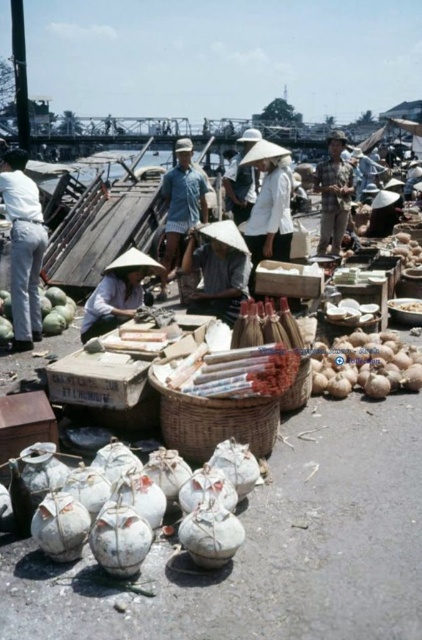
You are a vendor at the market and want to place the smooth brown coconuts at center and the checkered fabric shirt at center on a shelf. Which item should you place first if you want to arrange them from smallest to largest?

The smooth brown coconuts at center is smaller than the checkered fabric shirt at center, so you should place the smooth brown coconuts at center first when arranging from smallest to largest.

You are a vendor at the market and need to arrange items on a narrow shelf. The smooth brown coconuts at center and the checkered fabric shirt at center must be placed side by side. Which item should you place first to ensure they both fit?

The smooth brown coconuts at center has a lesser width compared to the checkered fabric shirt at center, so you should place the checkered fabric shirt at center first to ensure both items can fit on the narrow shelf.